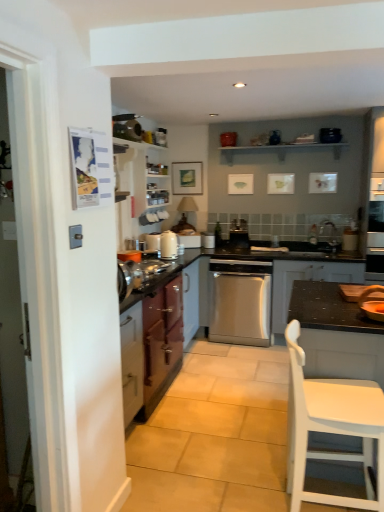
Where is `free spot to the left of white plastic chair at lower right`? free spot to the left of white plastic chair at lower right is located at coordinates (250, 489).